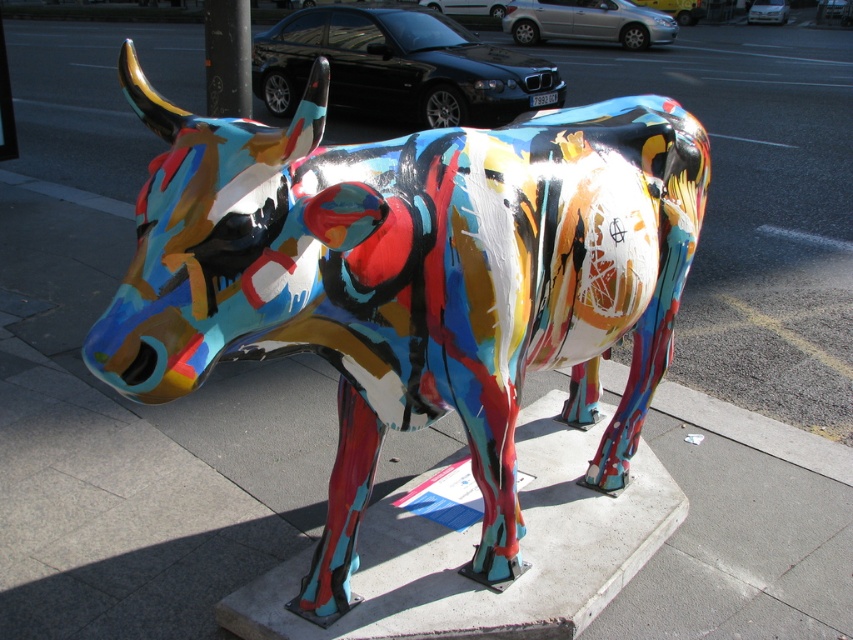
Question: Based on their relative distances, which object is nearer to the black glossy pole at upper center?

Choices:
 (A) metallic multicolored cow at center
 (B) metallic concrete at lower center

Answer: (A)

Question: Which point appears closest to the camera in this image?

Choices:
 (A) (527, 342)
 (B) (204, 4)
 (C) (527, 497)

Answer: (A)

Question: Does metallic concrete at lower center have a greater width compared to black glossy pole at upper center?

Choices:
 (A) yes
 (B) no

Answer: (A)

Question: Which point appears farthest from the camera in this image?

Choices:
 (A) (596, 304)
 (B) (204, 1)
 (C) (463, 557)

Answer: (B)

Question: Observing the image, what is the correct spatial positioning of metallic multicolored cow at center in reference to black glossy pole at upper center?

Choices:
 (A) below
 (B) above

Answer: (A)

Question: Is metallic multicolored cow at center smaller than black glossy pole at upper center?

Choices:
 (A) no
 (B) yes

Answer: (A)